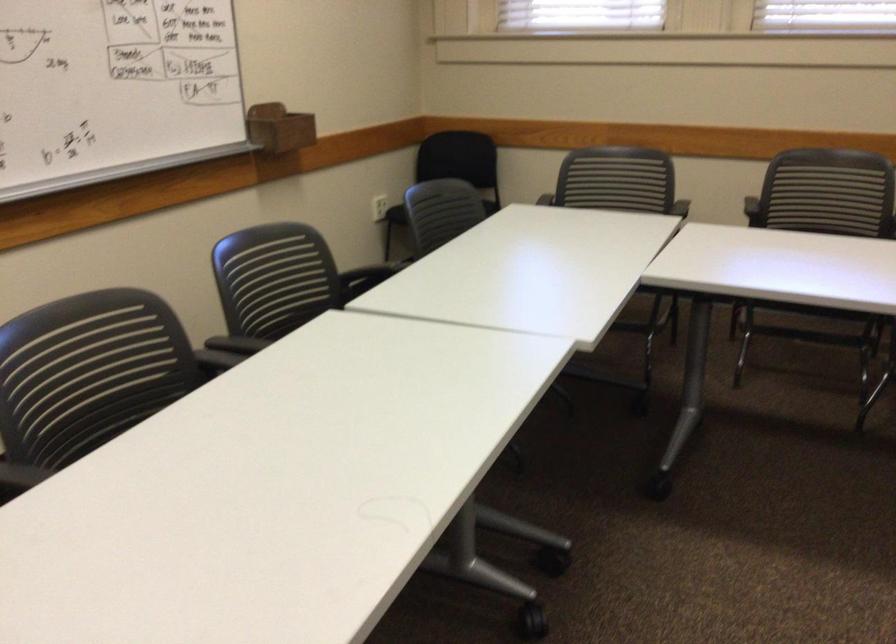
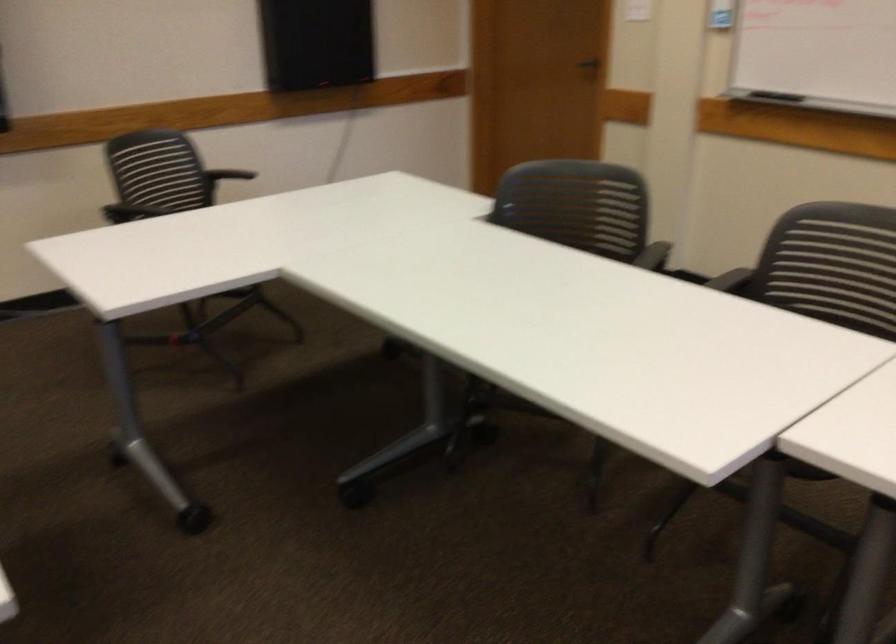
The first image is from the beginning of the video and the second image is from the end. How did the camera likely rotate when shooting the video?

The camera rotated toward left-down.